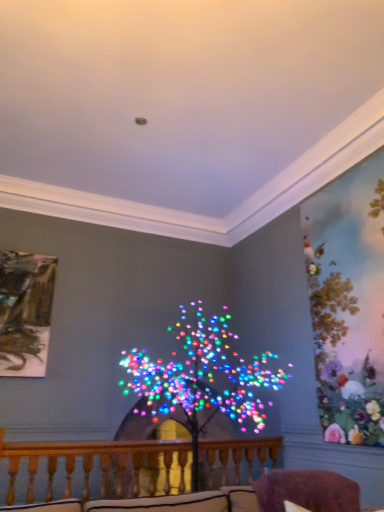
Question: Considering the positions of multicolored lights at center and wooden at center in the image, is multicolored lights at center bigger or smaller than wooden at center?

Choices:
 (A) small
 (B) big

Answer: (B)

Question: Considering the positions of multicolored lights at center and wooden at center in the image, is multicolored lights at center wider or thinner than wooden at center?

Choices:
 (A) wide
 (B) thin

Answer: (A)

Question: Considering the real-world distances, which object is closest to the wooden at center?

Choices:
 (A) purple fuzzy swivel chair at lower right
 (B) multicolored lights at center

Answer: (B)

Question: Which object is positioned farthest from the multicolored lights at center?

Choices:
 (A) wooden at center
 (B) purple fuzzy swivel chair at lower right

Answer: (B)